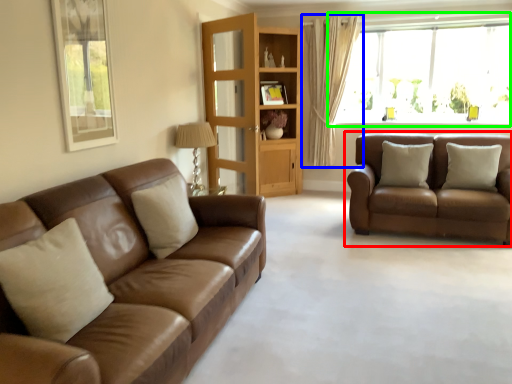
Question: Which object is the closest to the studio couch (highlighted by a red box)? Choose among these: curtain (highlighted by a blue box) or window (highlighted by a green box).

Choices:
 (A) curtain
 (B) window

Answer: (B)